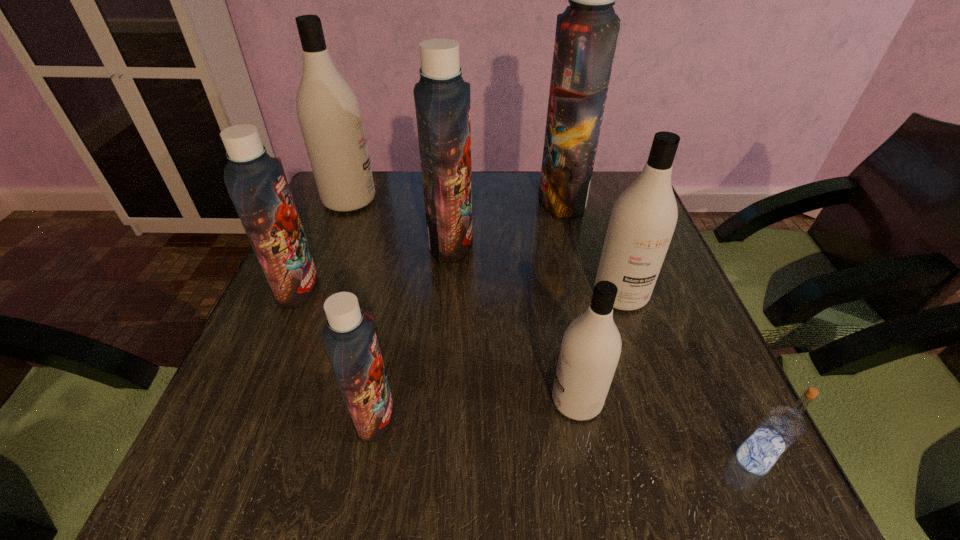
Locate an element on the screen. The image size is (960, 540). object at the far left corner is located at coordinates (329, 114).

Find the location of a particular element. The image size is (960, 540). object located in the far right corner section of the desktop is located at coordinates (586, 35).

Where is `object positioned at the near right corner`? This screenshot has height=540, width=960. object positioned at the near right corner is located at coordinates (781, 427).

This screenshot has width=960, height=540. In order to click on blank area at the far edge in this screenshot , I will do `click(490, 177)`.

This screenshot has width=960, height=540. I want to click on free space at the near edge of the desktop, so click(x=530, y=487).

At what (x,y) coordinates should I click in order to perform the action: click on free location at the left edge. Please return your answer as a coordinate pair (x, y). This screenshot has width=960, height=540. Looking at the image, I should click on 359,222.

In the image, there is a desktop. Identify the location of blank space at the right edge. (692, 427).

Identify the location of vacant area between the smallest blue shampoo and the fourth object from left to right. The image size is (960, 540). (413, 328).

Identify the location of empty space between the third object from left to right and the second farthest white shampoo. The height and width of the screenshot is (540, 960). (497, 355).

You are a GUI agent. You are given a task and a screenshot of the screen. Output one action in this format:
    pyautogui.click(x=<x>, y=<y>)
    Task: Click on the unoccupied position between the blue vodka and the rightmost white shampoo
    
    Given the screenshot: What is the action you would take?
    pyautogui.click(x=686, y=377)